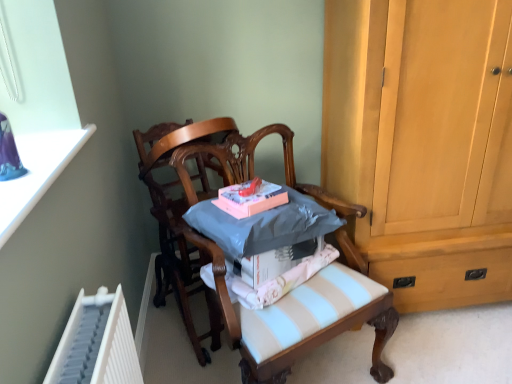
Question: Which direction should I rotate to look at wooden chair at center, the second chair positioned from the right?

Choices:
 (A) left
 (B) right

Answer: (A)

Question: Is light blue striped fabric at center outside wooden chair at center, the second chair positioned from the right?

Choices:
 (A) no
 (B) yes

Answer: (B)

Question: Is light blue striped fabric at center oriented towards wooden chair at center, the second chair positioned from the right?

Choices:
 (A) no
 (B) yes

Answer: (A)

Question: Considering the relative positions of light blue striped fabric at center and wooden chair at center, the second chair positioned from the right, in the image provided, is light blue striped fabric at center to the right of wooden chair at center, the second chair positioned from the right, from the viewer's perspective?

Choices:
 (A) no
 (B) yes

Answer: (B)

Question: Can you confirm if light blue striped fabric at center is bigger than wooden chair at center, the second chair positioned from the right?

Choices:
 (A) yes
 (B) no

Answer: (B)

Question: From the image's perspective, is light blue striped fabric at center located above wooden chair at center, the 1th chair in the left-to-right sequence?

Choices:
 (A) no
 (B) yes

Answer: (A)

Question: Are light blue striped fabric at center and wooden chair at center, the 1th chair in the left-to-right sequence, beside each other?

Choices:
 (A) no
 (B) yes

Answer: (A)

Question: Considering the relative sizes of light brown wood cabinet at right and wooden chair at center, the 2th chair viewed from the left, in the image provided, is light brown wood cabinet at right bigger than wooden chair at center, the 2th chair viewed from the left,?

Choices:
 (A) no
 (B) yes

Answer: (B)

Question: Considering the relative sizes of light brown wood cabinet at right and wooden chair at center, the 2th chair viewed from the left, in the image provided, is light brown wood cabinet at right wider than wooden chair at center, the 2th chair viewed from the left,?

Choices:
 (A) yes
 (B) no

Answer: (A)

Question: Does light brown wood cabinet at right come in front of wooden chair at center, marked as the 1th chair in a right-to-left arrangement?

Choices:
 (A) no
 (B) yes

Answer: (A)

Question: Does light brown wood cabinet at right appear on the left side of wooden chair at center, the 2th chair viewed from the left?

Choices:
 (A) yes
 (B) no

Answer: (B)

Question: Is light brown wood cabinet at right outside of wooden chair at center, the 2th chair viewed from the left?

Choices:
 (A) yes
 (B) no

Answer: (A)

Question: Is light brown wood cabinet at right facing away from wooden chair at center, the 2th chair viewed from the left?

Choices:
 (A) no
 (B) yes

Answer: (A)

Question: Is light blue striped fabric at center beside wooden chair at center, marked as the 1th chair in a right-to-left arrangement?

Choices:
 (A) yes
 (B) no

Answer: (B)